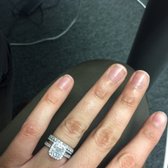
Find the location of `carpet`. carpet is located at coordinates (104, 28).